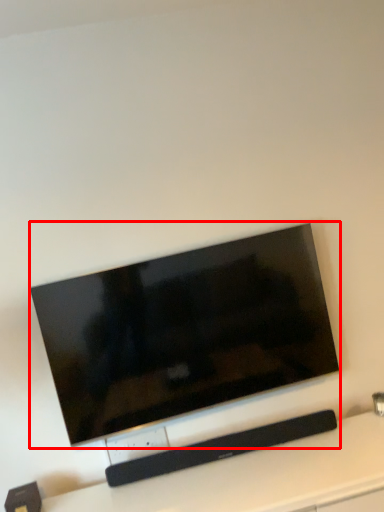
Question: From the image's perspective, considering the relative positions of television (annotated by the red box) and furniture in the image provided, where is television (annotated by the red box) located with respect to the staircase?

Choices:
 (A) above
 (B) below

Answer: (A)